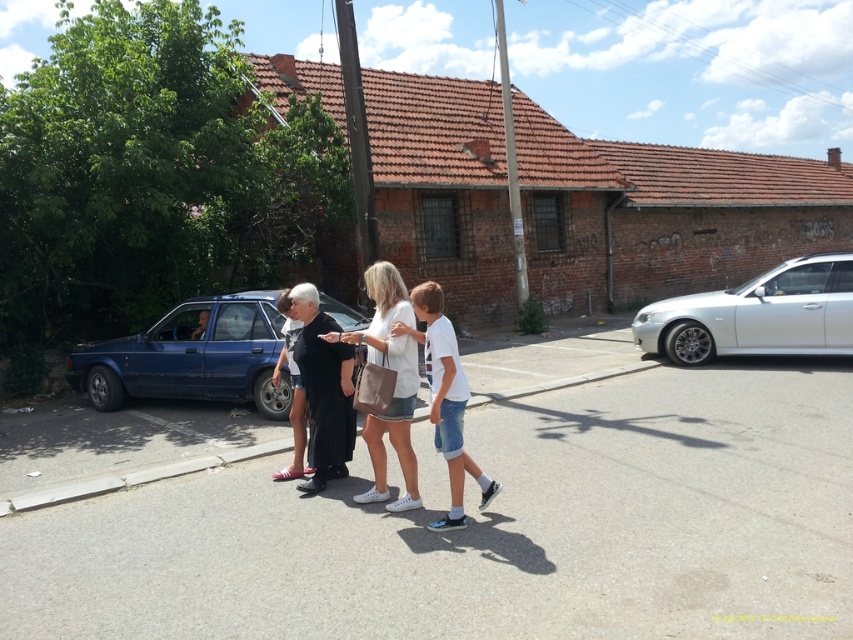
Is point (119, 364) behind point (676, 339)?

No, (119, 364) is closer to viewer.

Is blue matte sedan at left bigger than white metallic car at right?

Indeed, blue matte sedan at left has a larger size compared to white metallic car at right.

The height and width of the screenshot is (640, 853). What do you see at coordinates (192, 356) in the screenshot?
I see `blue matte sedan at left` at bounding box center [192, 356].

Locate an element on the screen. Image resolution: width=853 pixels, height=640 pixels. blue matte sedan at left is located at coordinates (192, 356).

Does white metallic car at right have a larger size compared to white matte shirt at center?

Yes, white metallic car at right is bigger than white matte shirt at center.

Is the position of white metallic car at right less distant than that of white matte shirt at center?

No, white metallic car at right is behind white matte shirt at center.

The height and width of the screenshot is (640, 853). What do you see at coordinates (757, 314) in the screenshot?
I see `white metallic car at right` at bounding box center [757, 314].

The width and height of the screenshot is (853, 640). I want to click on white metallic car at right, so click(757, 314).

Who is more distant from viewer, (686,314) or (204,316)?

Point (686,314)

What do you see at coordinates (757, 314) in the screenshot? I see `white metallic car at right` at bounding box center [757, 314].

Locate an element on the screen. white metallic car at right is located at coordinates (757, 314).